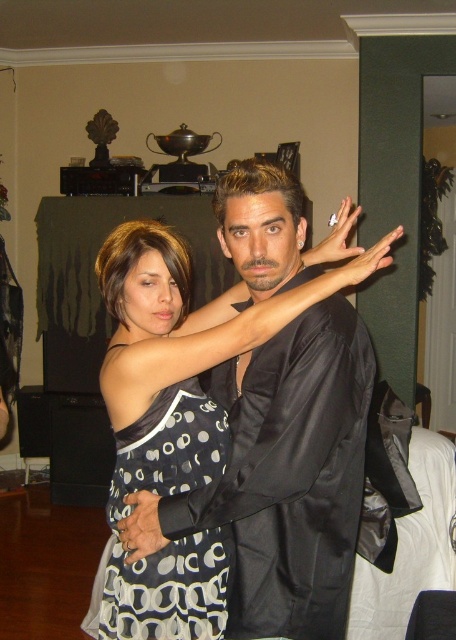
Question: Is black satin dress at center behind black dotted fabric dress at center?

Choices:
 (A) yes
 (B) no

Answer: (A)

Question: Is black satin dress at center positioned in front of black dotted fabric dress at center?

Choices:
 (A) no
 (B) yes

Answer: (A)

Question: Among these points, which one is nearest to the camera?

Choices:
 (A) (122, 611)
 (B) (326, 259)

Answer: (A)

Question: Which point is farther to the camera?

Choices:
 (A) black satin dress at center
 (B) black dotted fabric dress at center

Answer: (A)

Question: Observing the image, what is the correct spatial positioning of black satin dress at center in reference to black dotted fabric dress at center?

Choices:
 (A) below
 (B) above

Answer: (B)